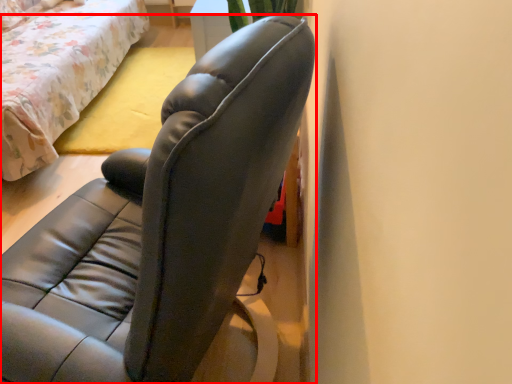
Question: From the image's perspective, where is chair (annotated by the red box) located relative to bed?

Choices:
 (A) above
 (B) below

Answer: (B)